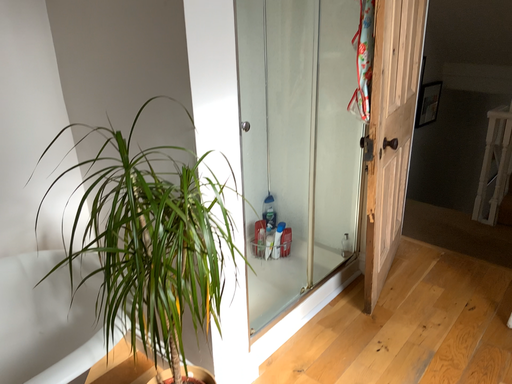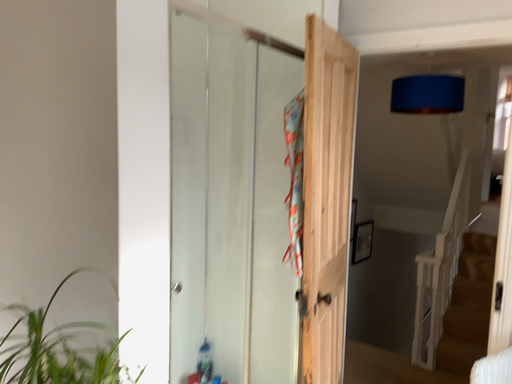
Question: Which way did the camera rotate in the video?

Choices:
 (A) rotated upward
 (B) rotated downward

Answer: (A)